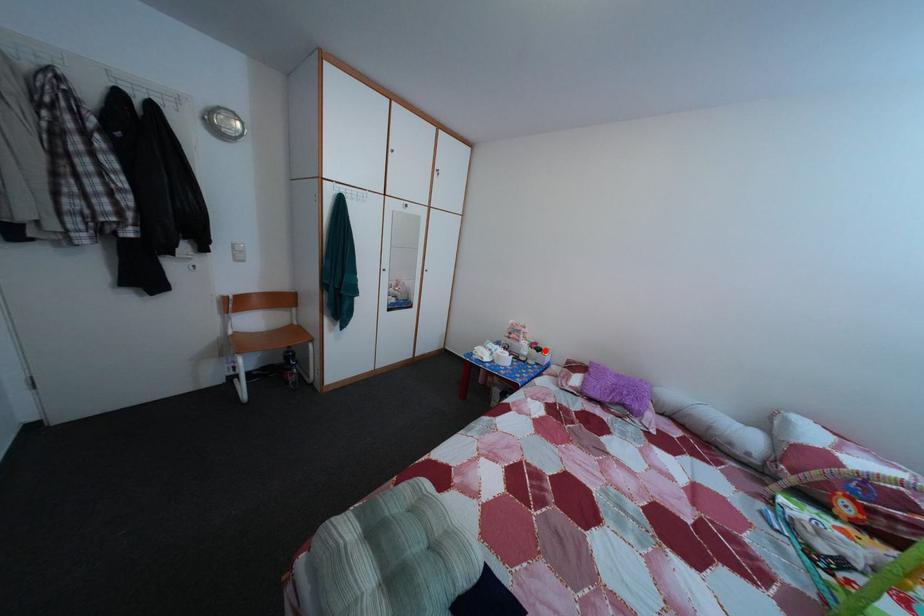
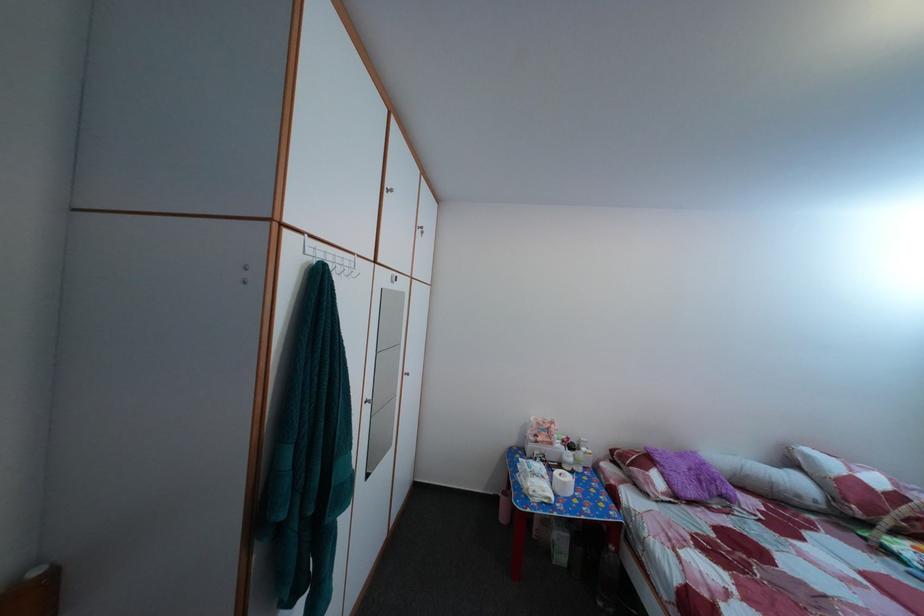
Question: I am providing you with two images of the same scene from different viewpoints. A red point is shown in image1. For the corresponding object point in image2, is it positioned nearer or farther from the camera?

Choices:
 (A) Nearer
 (B) Farther

Answer: (B)